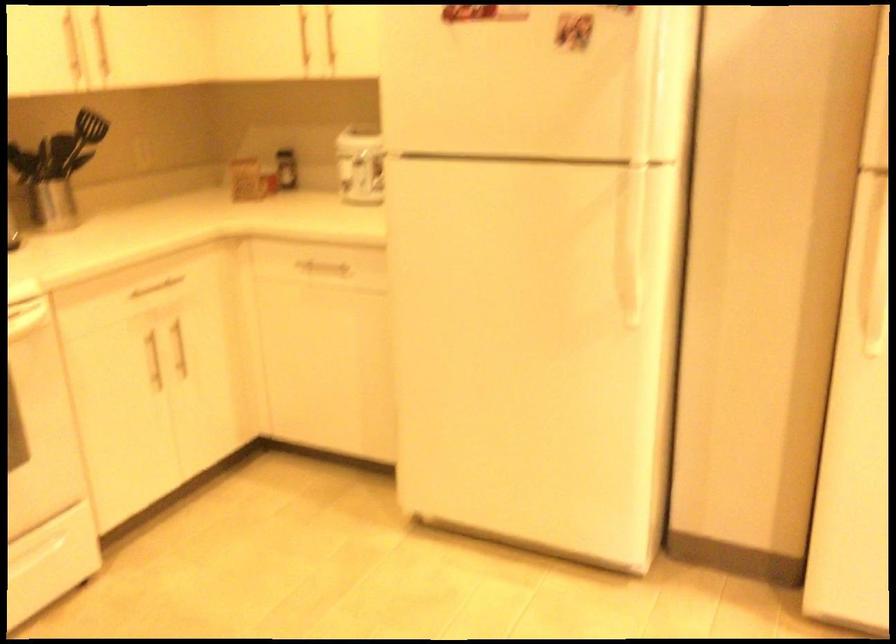
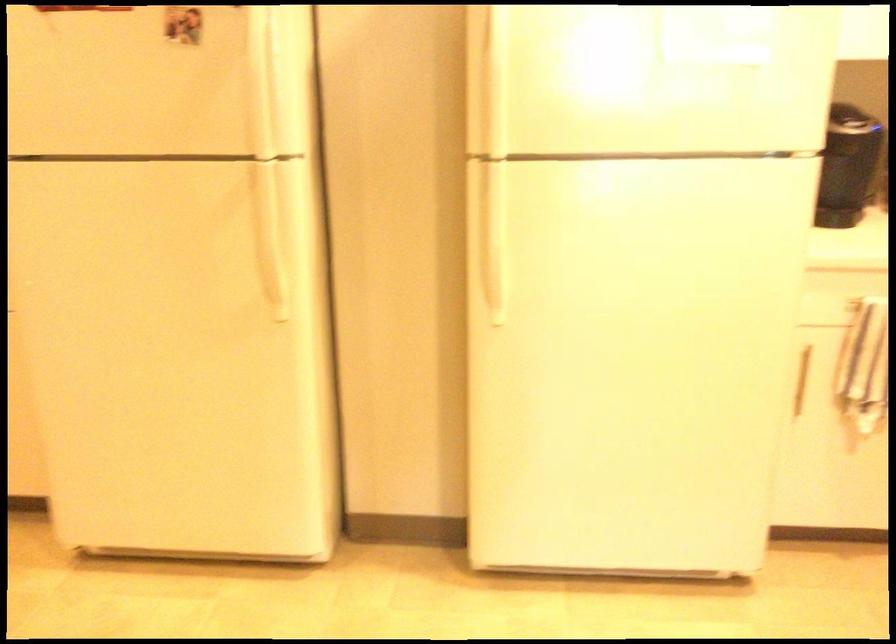
Question: The images are taken continuously from a first-person perspective. In which direction is your viewpoint rotating?

Choices:
 (A) Left
 (B) Right
 (C) Up
 (D) Down

Answer: (B)